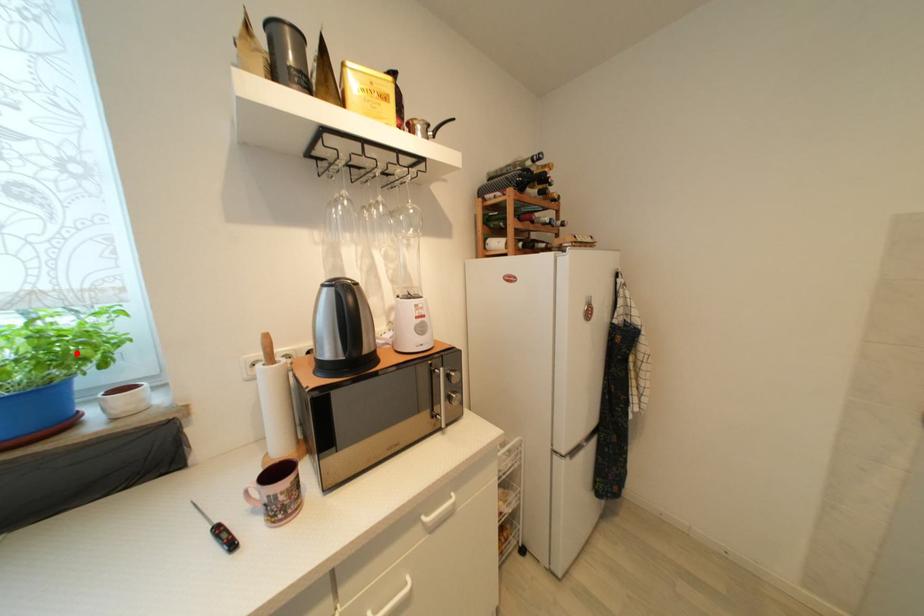
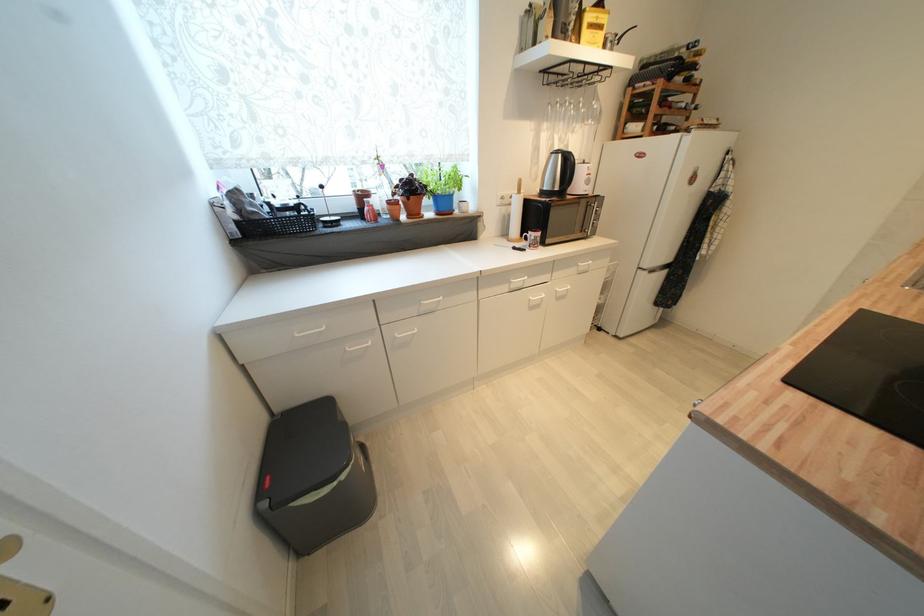
Question: A red point is marked in image1. In image2, is the corresponding 3D point closer to the camera or farther? Reply with the corresponding letter.

Choices:
 (A) The corresponding 3D point is closer.
 (B) The corresponding 3D point is farther.

Answer: (A)